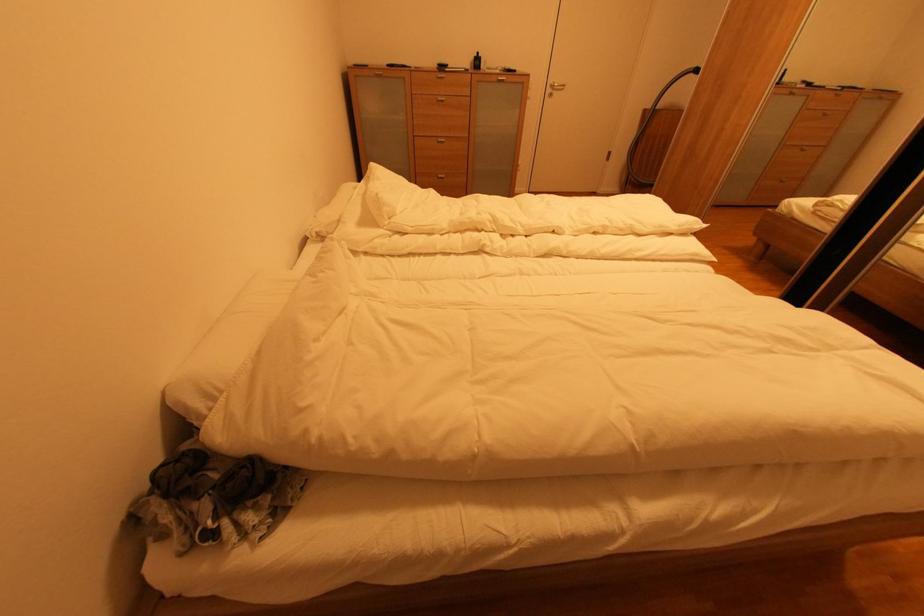
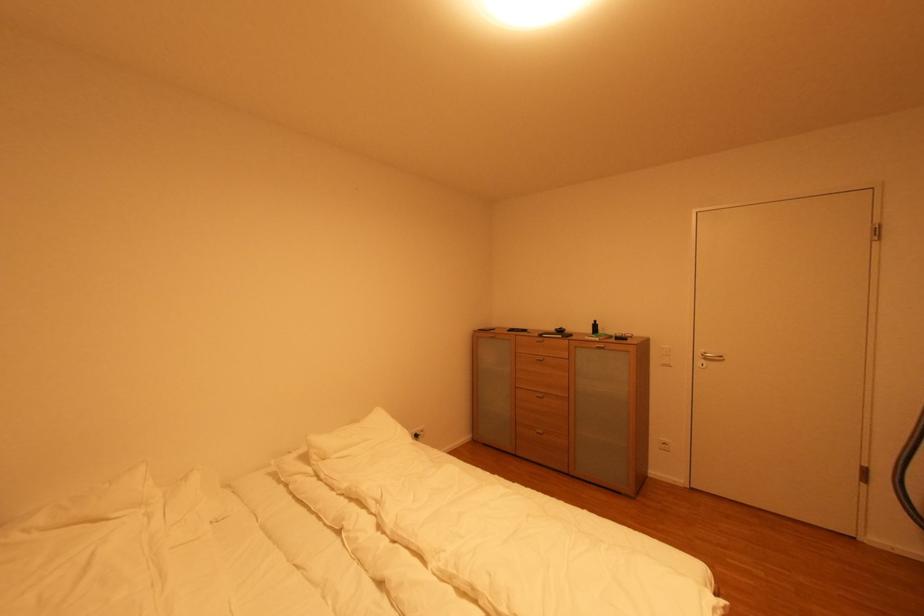
The point at (614, 233) is marked in the first image. Where is the corresponding point in the second image?

(485, 606)